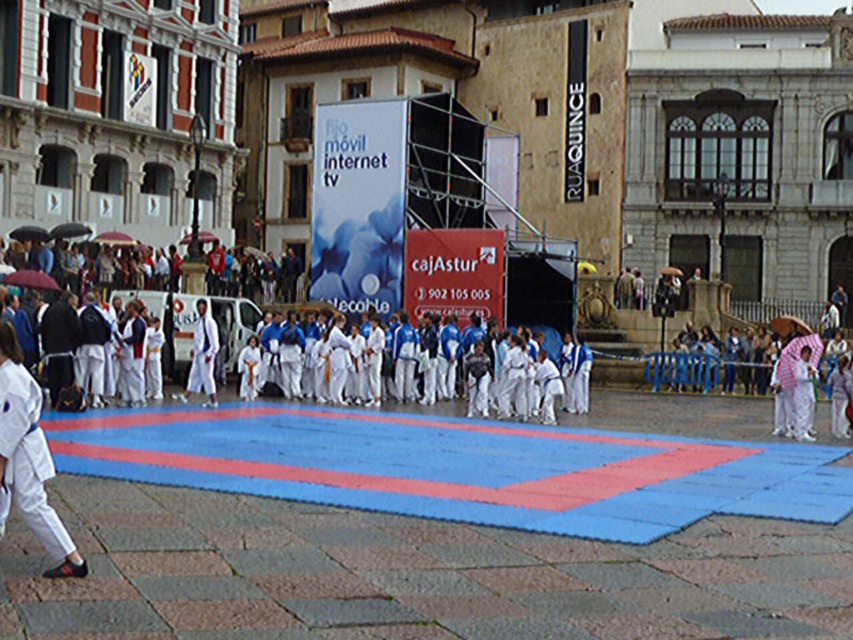
Does white cotton karate gi at lower left lie behind white cotton kimono at center?

No, white cotton karate gi at lower left is in front of white cotton kimono at center.

Describe the element at coordinates (28, 460) in the screenshot. I see `white cotton karate gi at lower left` at that location.

Locate an element on the screen. white cotton karate gi at lower left is located at coordinates (28, 460).

Can you confirm if white cotton clothing at upper center is smaller than white cotton karate uniform at center?

Incorrect, white cotton clothing at upper center is not smaller in size than white cotton karate uniform at center.

Is white cotton clothing at upper center closer to the viewer compared to white cotton karate uniform at center?

No, white cotton clothing at upper center is further to the viewer.

Is point (65, 259) closer to camera compared to point (202, 352)?

No, (65, 259) is behind (202, 352).

In order to click on white cotton clothing at upper center in this screenshot , I will do `click(94, 260)`.

Between white cotton clothing at upper center and white cotton kimono at center, which one appears on the left side from the viewer's perspective?

Positioned to the left is white cotton clothing at upper center.

Is point (228, 282) positioned after point (811, 416)?

Yes, point (228, 282) is farther from viewer.

What are the coordinates of `white cotton clothing at upper center` in the screenshot? It's located at (94, 260).